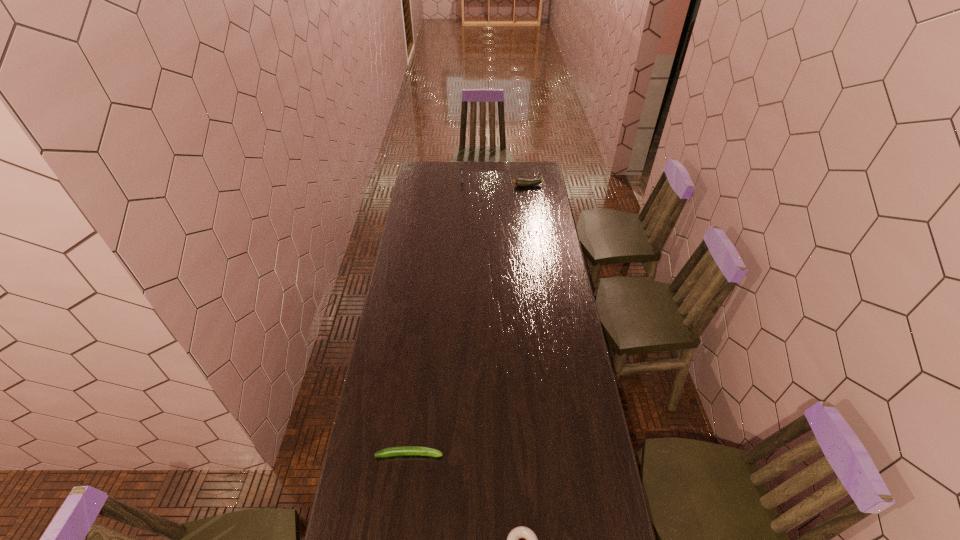
Locate an element on the screen. The image size is (960, 540). free spot located on the front-facing side of the nearer zucchini is located at coordinates (475, 454).

Identify the location of object positioned at the far edge. (461, 172).

Where is `object that is at the left edge`? The width and height of the screenshot is (960, 540). object that is at the left edge is located at coordinates (x=400, y=450).

Identify the location of object that is positioned at the right edge. (519, 182).

Locate an element on the screen. This screenshot has width=960, height=540. free space at the far edge is located at coordinates (488, 171).

Image resolution: width=960 pixels, height=540 pixels. In the image, there is a desktop. What are the coordinates of `free region at the left edge` in the screenshot? It's located at (409, 261).

Where is `vacant space at the right edge`? vacant space at the right edge is located at coordinates (533, 197).

Locate an element on the screen. The image size is (960, 540). vacant region at the far left corner of the desktop is located at coordinates (426, 171).

Find the location of `vacant space in between the tallest object and the rightmost object`. vacant space in between the tallest object and the rightmost object is located at coordinates (495, 183).

The width and height of the screenshot is (960, 540). What are the coordinates of `free space between the farthest object and the nearer zucchini` in the screenshot? It's located at (436, 317).